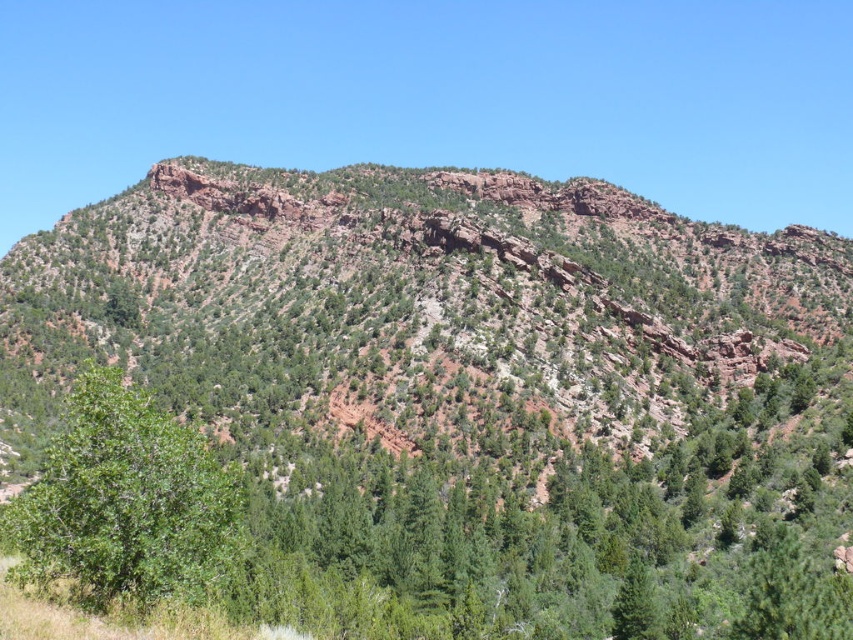
Can you confirm if green leafy tree at center is bigger than green leafy tree at lower left?

Yes, green leafy tree at center is bigger than green leafy tree at lower left.

Between green leafy tree at center and green leafy tree at lower left, which one appears on the left side from the viewer's perspective?

green leafy tree at lower left is more to the left.

Locate an element on the screen. green leafy tree at center is located at coordinates (532, 532).

At what (x,y) coordinates should I click in order to perform the action: click on green leafy tree at center. Please return your answer as a coordinate pair (x, y). Looking at the image, I should click on (532, 532).

Who is shorter, rustic rock mountain at center or green leafy tree at lower left?

green leafy tree at lower left is shorter.

Does rustic rock mountain at center have a greater height compared to green leafy tree at lower left?

Indeed, rustic rock mountain at center has a greater height compared to green leafy tree at lower left.

Image resolution: width=853 pixels, height=640 pixels. I want to click on rustic rock mountain at center, so click(416, 308).

Locate an element on the screen. The image size is (853, 640). rustic rock mountain at center is located at coordinates (416, 308).

Does rustic rock mountain at center appear under green leafy tree at center?

Answer: Incorrect, rustic rock mountain at center is not positioned below green leafy tree at center.

Describe the element at coordinates (416, 308) in the screenshot. I see `rustic rock mountain at center` at that location.

Identify the location of rustic rock mountain at center. The height and width of the screenshot is (640, 853). (416, 308).